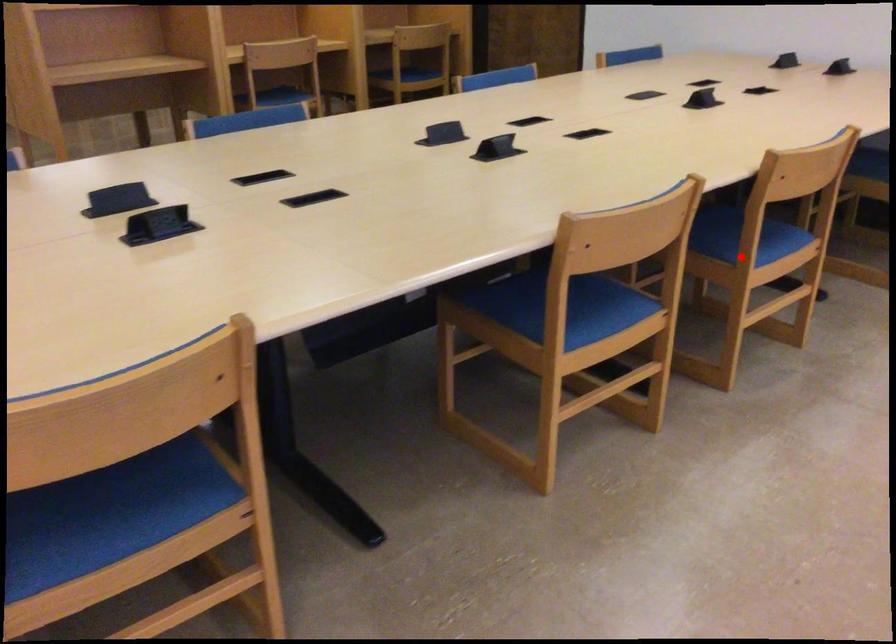
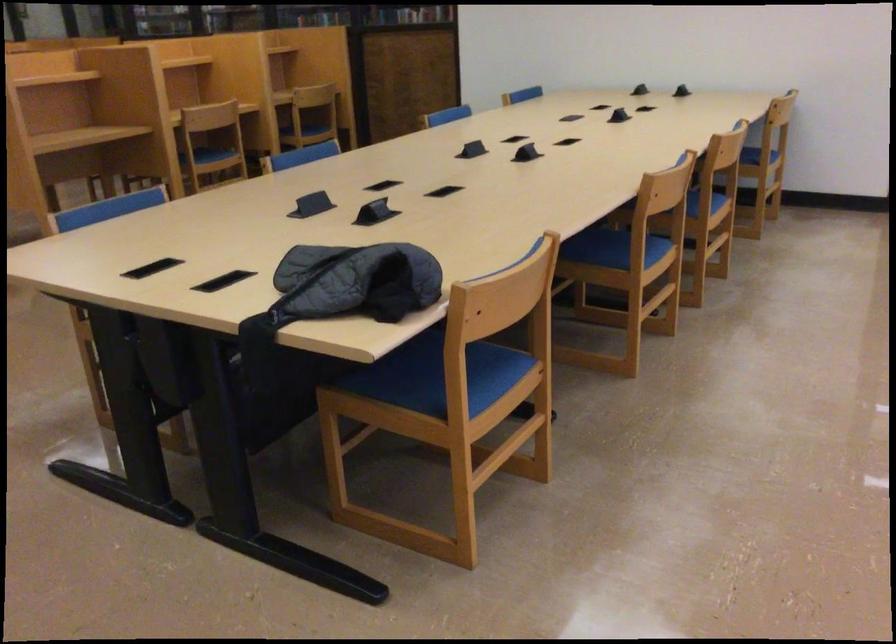
Question: I am providing you with two images of the same scene from different viewpoints. A red point is shown in image1. For the corresponding object point in image2, is it positioned nearer or farther from the camera?

Choices:
 (A) Nearer
 (B) Farther

Answer: (B)